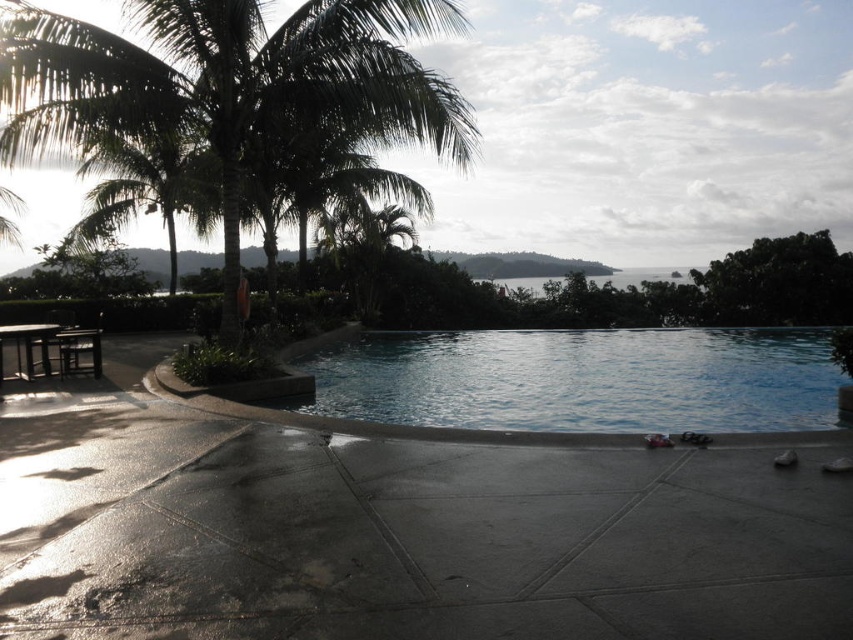
You are standing at the center of the infinity pool and want to locate the green leafy palm tree at upper left. According to the coordinates given, in which direction should you look to find it?

The green leafy palm tree at upper left is located at coordinates 0.128 on the x axis and 0.272 on the y axis. Since the x coordinate is less than 0.5, it is to the left of the center. The y coordinate is also less than 0.5, meaning it is above the center. Therefore, you should look to the upper left direction to find the green leafy palm tree at upper left.

You are standing at the edge of the pool and want to place a floating toy in the clear blue water at center. Considering the green leafy palm tree at upper left, will the toy be visible from below the water surface?

The green leafy palm tree at upper left is above clear blue water at center, so the toy placed in the clear blue water at center will be visible from below the water surface since the palm tree is above it and not blocking the view.